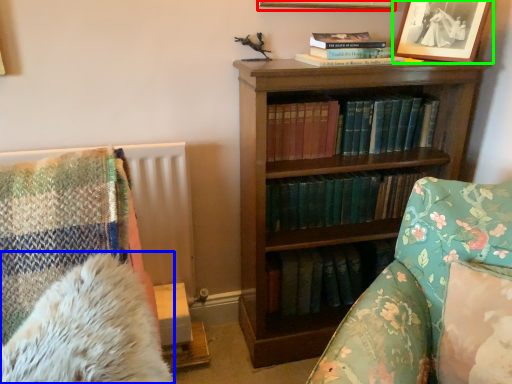
Question: Which is farther away from picture frame (highlighted by a red box)? chiffonier (highlighted by a blue box) or picture frame (highlighted by a green box)?

Choices:
 (A) chiffonier
 (B) picture frame

Answer: (A)